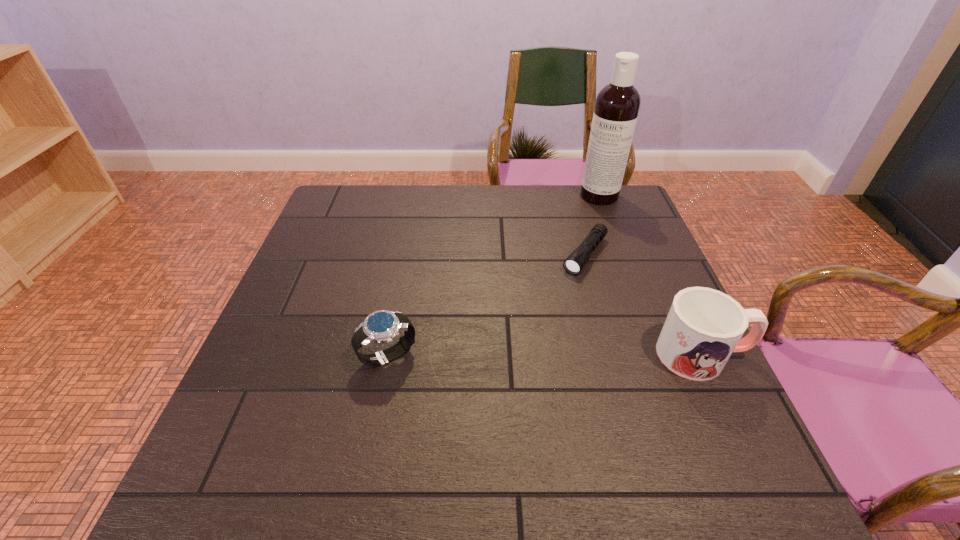
You are a GUI agent. You are given a task and a screenshot of the screen. Output one action in this format:
    pyautogui.click(x=<x>, y=<y>)
    Task: Click on the leftmost object
    
    Given the screenshot: What is the action you would take?
    pyautogui.click(x=382, y=326)

The height and width of the screenshot is (540, 960). I want to click on watch, so click(382, 326).

Where is `the third shortest object`? This screenshot has height=540, width=960. the third shortest object is located at coordinates (704, 326).

At what (x,y) coordinates should I click in order to perform the action: click on flashlight. Please return your answer as a coordinate pair (x, y). The image size is (960, 540). Looking at the image, I should click on (575, 262).

What are the coordinates of `the second farthest object` in the screenshot? It's located at (575, 262).

This screenshot has height=540, width=960. Find the location of `the farthest object`. the farthest object is located at coordinates (617, 105).

Where is `dishwasher detergent`? dishwasher detergent is located at coordinates (617, 105).

I want to click on vacant region located 0.310m on the right of the third tallest object, so click(x=559, y=356).

I want to click on vacant point located 0.380m at the lens end of the second farthest object, so click(500, 373).

At what (x,y) coordinates should I click in order to perform the action: click on vacant space located 0.200m at the lens end of the second farthest object. Please return your answer as a coordinate pair (x, y). Image resolution: width=960 pixels, height=540 pixels. Looking at the image, I should click on (540, 321).